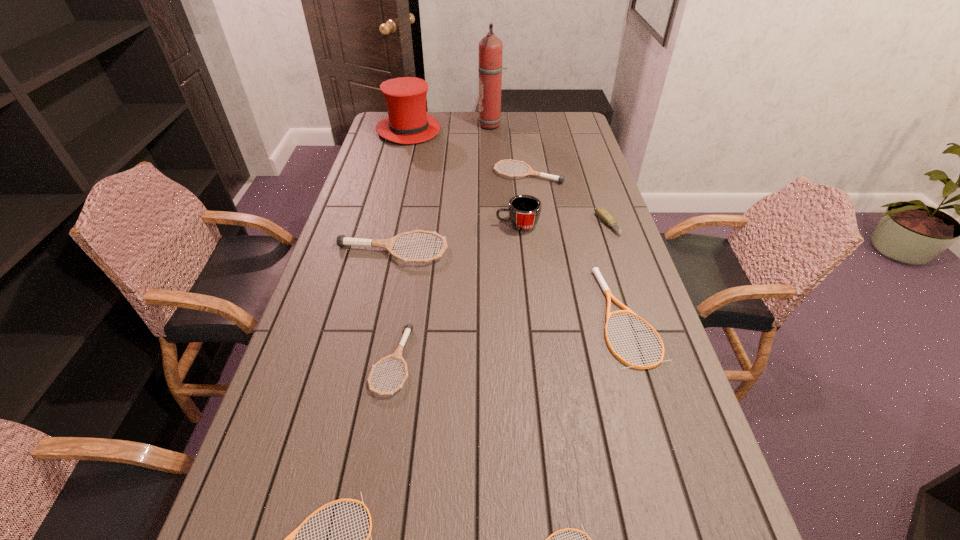
I want to click on free region that satisfies the following two spatial constraints: 1. on the side of the gray pocketknife with the label and nozzle; 2. on the left side of the fire extinguisher, so click(496, 225).

Locate an element on the screen. This screenshot has height=540, width=960. vacant space that satisfies the following two spatial constraints: 1. on the side of the third shortest tennis racket with the handle; 2. on the right side of the mug is located at coordinates (527, 316).